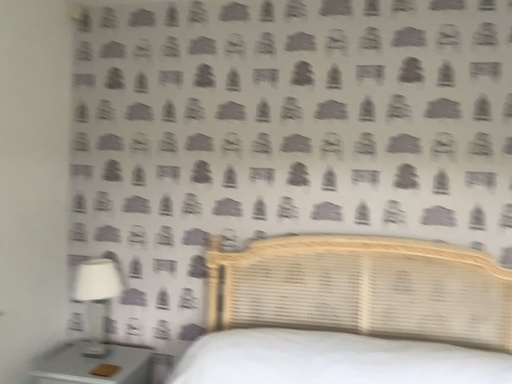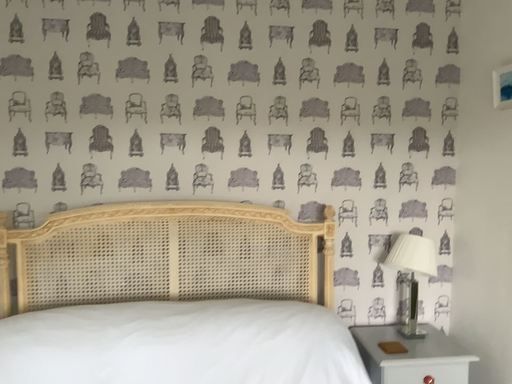
Question: Which way did the camera rotate in the video?

Choices:
 (A) rotated left
 (B) rotated right

Answer: (B)